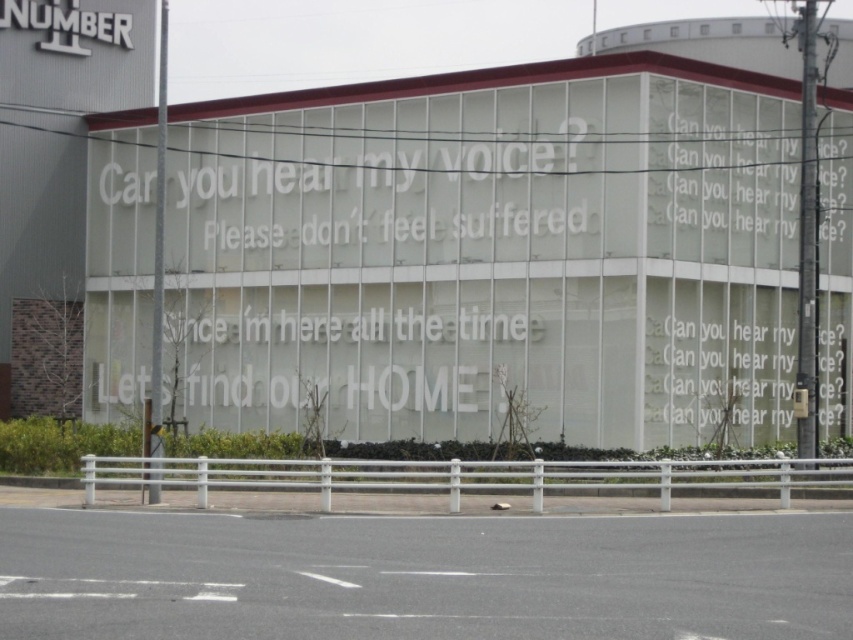
Question: Which point is farther to the camera?

Choices:
 (A) white paper text at upper right
 (B) white metallic sign at upper left

Answer: (B)

Question: Does white metallic sign at upper left appear over white paper text at upper right?

Choices:
 (A) yes
 (B) no

Answer: (A)

Question: Can you confirm if white metallic sign at upper left is thinner than white paper text at upper right?

Choices:
 (A) no
 (B) yes

Answer: (B)

Question: Among these objects, which one is farthest from the camera?

Choices:
 (A) white paper text at upper right
 (B) white metallic sign at upper left

Answer: (B)

Question: Among these objects, which one is nearest to the camera?

Choices:
 (A) white metallic sign at upper left
 (B) white paper text at upper right

Answer: (B)

Question: Can you confirm if white metallic sign at upper left is positioned above white paper text at upper right?

Choices:
 (A) yes
 (B) no

Answer: (A)